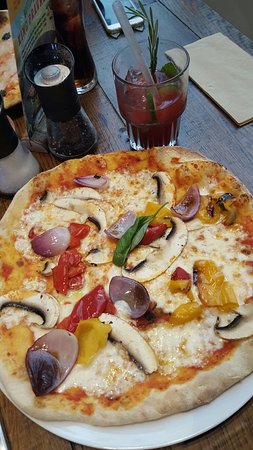
Locate an element on the screen. phone is located at coordinates (107, 21).